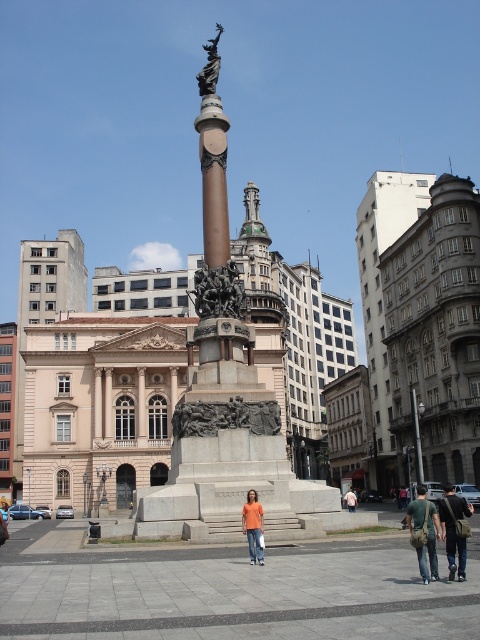
Question: Which object appears closest to the camera in this image?

Choices:
 (A) orange shirt at center
 (B) bronze statue at center
 (C) black matte sculpture at center
 (D) green canvas bag at lower right

Answer: (D)

Question: Is bronze statue at center positioned in front of orange shirt at center?

Choices:
 (A) no
 (B) yes

Answer: (A)

Question: Does black matte sculpture at center have a greater width compared to orange cotton shirt at center?

Choices:
 (A) yes
 (B) no

Answer: (A)

Question: Does black matte sculpture at center have a smaller size compared to bronze statue at center?

Choices:
 (A) yes
 (B) no

Answer: (A)

Question: Which is nearer to the orange t-shirt at center?

Choices:
 (A) orange shirt at center
 (B) dark blue jeans at lower right

Answer: (B)

Question: Which of the following is the closest to the observer?

Choices:
 (A) green canvas bag at lower right
 (B) orange shirt at center
 (C) orange cotton shirt at center

Answer: (A)